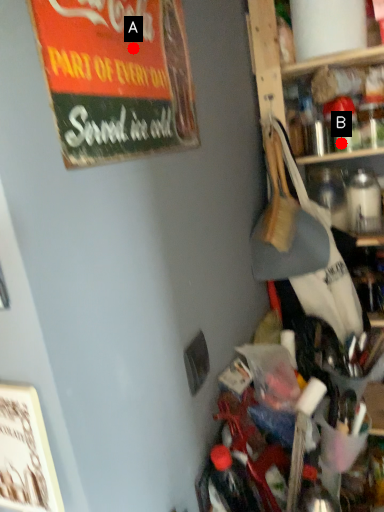
Question: Two points are circled on the image, labeled by A and B beside each circle. Which point appears closest to the camera in this image?

Choices:
 (A) A is closer
 (B) B is closer

Answer: (A)